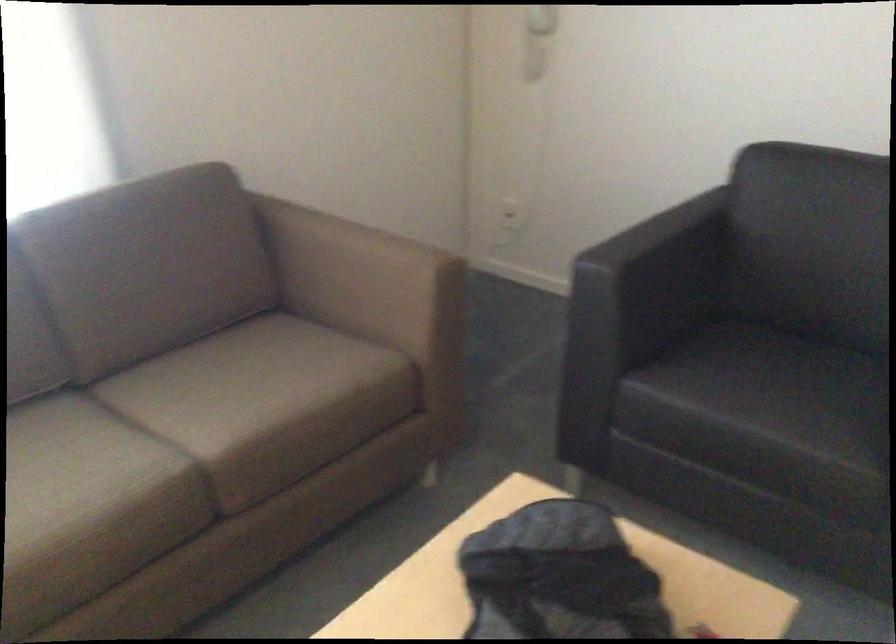
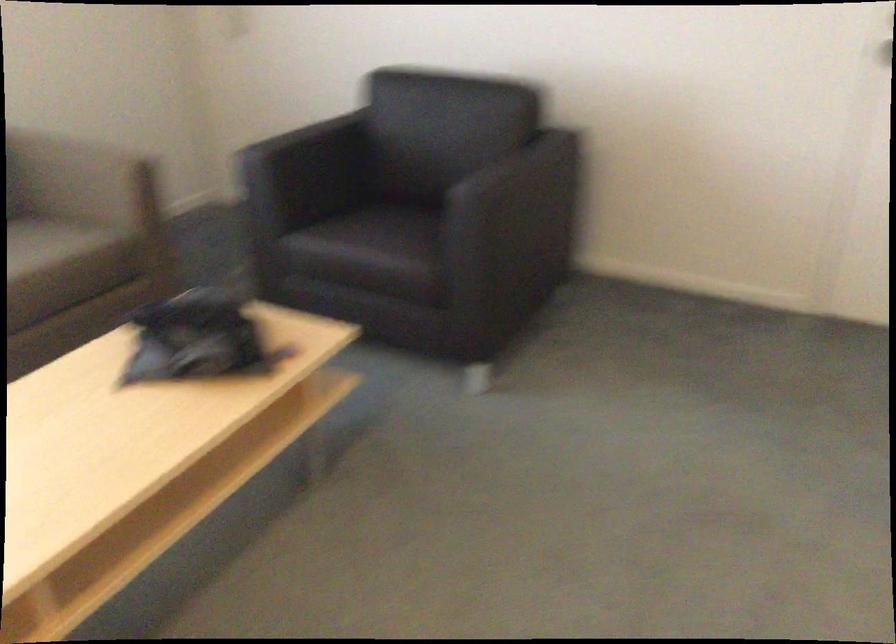
In the second image, find the point that corresponds to point 658,245 in the first image.

(304, 138)